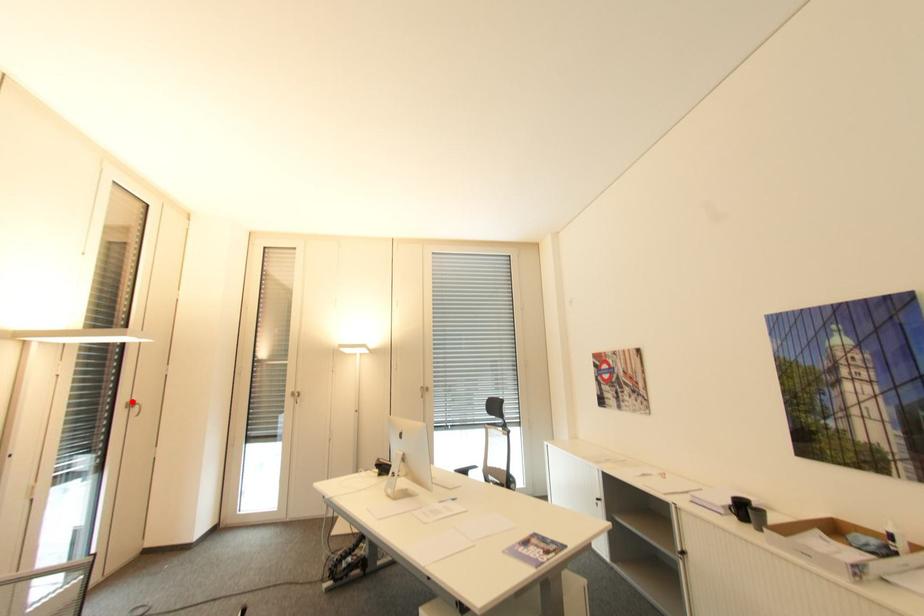
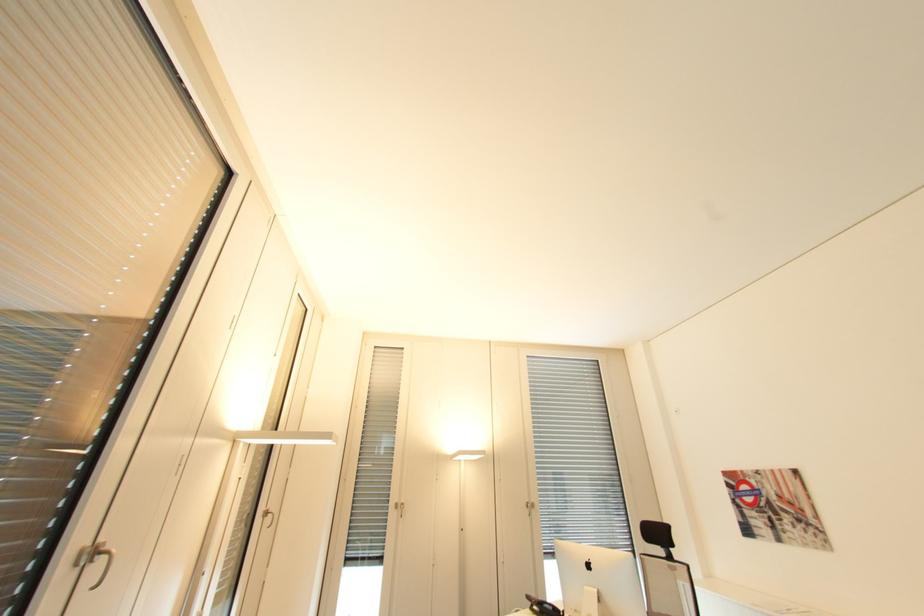
Question: I am providing you with two images of the same scene from different viewpoints. Image1 has a red point marked. In image2, the corresponding 3D location appears at what relative position? Reply with the corresponding letter.

Choices:
 (A) Closer
 (B) Farther

Answer: (B)